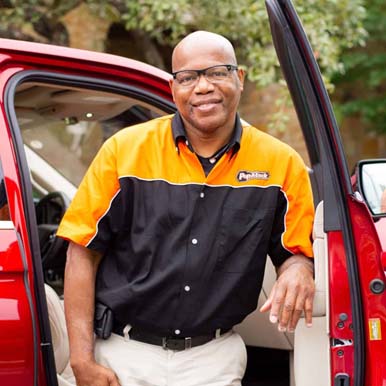
The width and height of the screenshot is (386, 386). In order to click on door in this screenshot , I will do `click(370, 329)`.